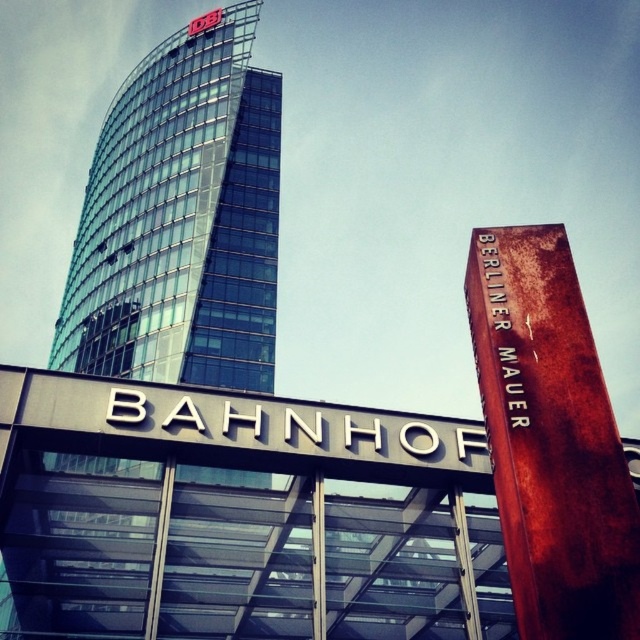
Question: Can you confirm if glassy steel skyscraper at upper left is positioned to the left of rusty metal berliner mauer at right?

Choices:
 (A) yes
 (B) no

Answer: (A)

Question: Can you confirm if glassy steel skyscraper at upper left is positioned below rusty metal berliner mauer at right?

Choices:
 (A) yes
 (B) no

Answer: (B)

Question: Which of the following is the farthest from the observer?

Choices:
 (A) (61, 561)
 (B) (586, 451)

Answer: (A)

Question: Does glassy steel skyscraper at upper left appear under rusty metal berliner mauer at right?

Choices:
 (A) yes
 (B) no

Answer: (B)